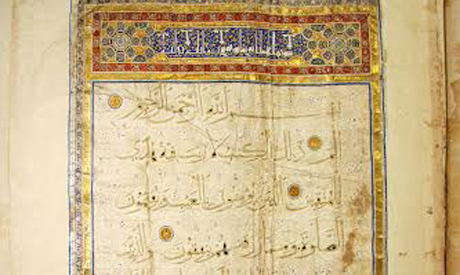
Find the location of a particular element. wall is located at coordinates (29, 119).